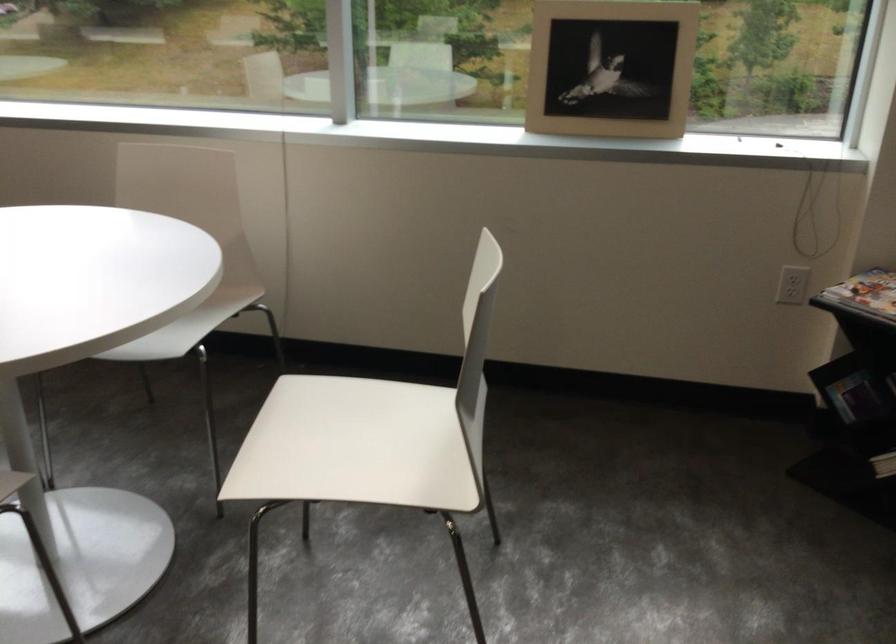
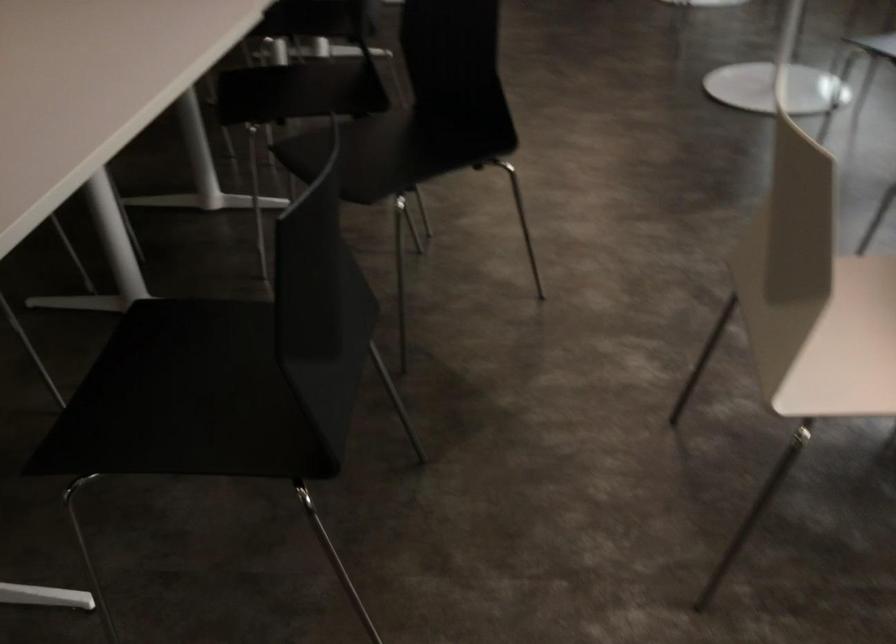
From the picture: How did the camera likely rotate?

The rotation direction of the camera is left-down.